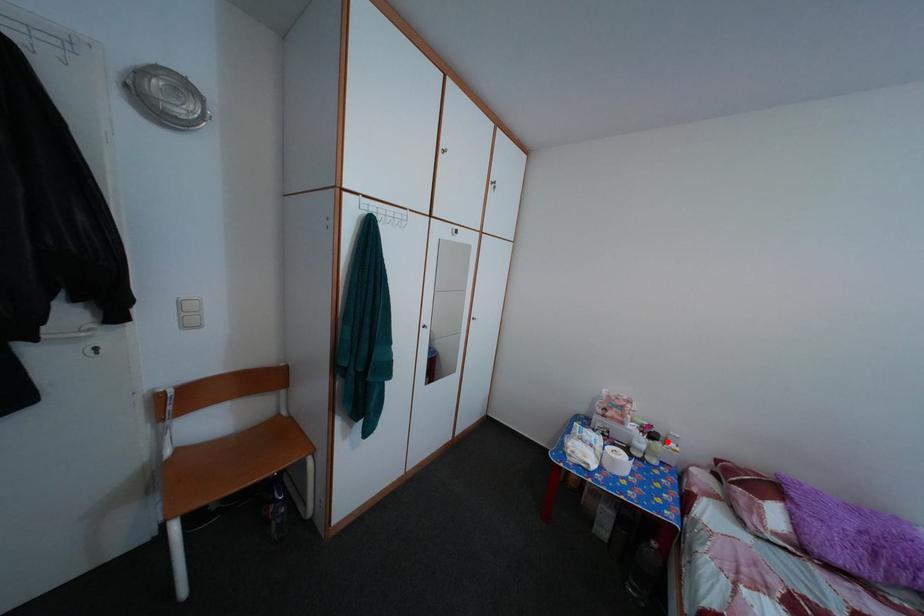
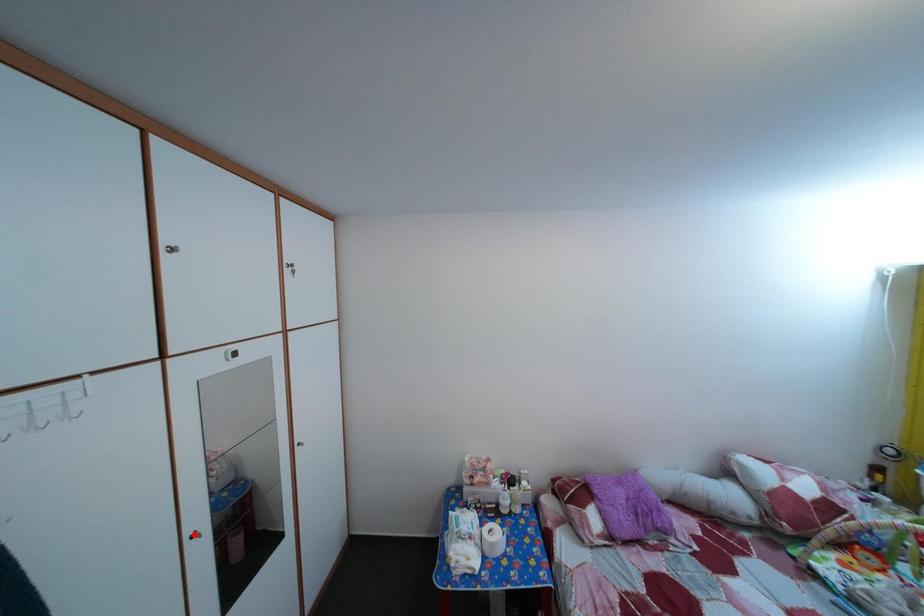
I am providing you with two images of the same scene from different viewpoints. A red point is marked on the first image and another point is marked on the second image. Does the point marked in image1 correspond to the same location as the one in image2?

No